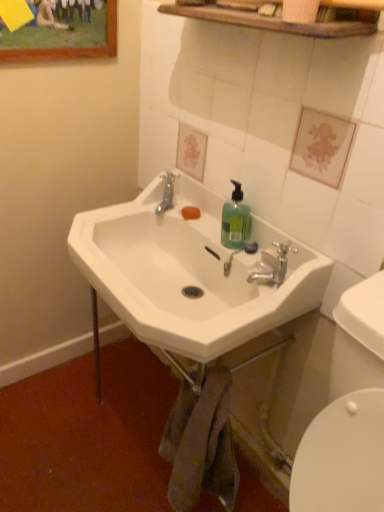
Question: Would you say silver metallic faucet at upper center, which appears as the second plumbing fixture when ordered from the bottom, is to the left or to the right of metallic silver faucet at lower center, which appears as the 2th plumbing fixture when viewed from the top, in the picture?

Choices:
 (A) right
 (B) left

Answer: (B)

Question: Looking at the image, does silver metallic faucet at upper center, the second plumbing fixture when ordered from right to left, seem bigger or smaller compared to metallic silver faucet at lower center, the 1th plumbing fixture viewed from the front?

Choices:
 (A) big
 (B) small

Answer: (A)

Question: Considering the real-world distances, which object is closest to the metallic silver faucet at lower center, which appears as the 2th plumbing fixture when viewed from the top?

Choices:
 (A) white ceramic sink at center
 (B) translucent green liquid at sink right
 (C) wooden framed painting at upper left
 (D) silver metallic faucet at upper center, which appears as the second plumbing fixture when ordered from the bottom

Answer: (B)

Question: Considering the real-world distances, which object is farthest from the translucent green liquid at sink right?

Choices:
 (A) white ceramic sink at center
 (B) metallic silver faucet at lower center, which is the 2th plumbing fixture from back to front
 (C) wooden framed painting at upper left
 (D) silver metallic faucet at upper center, marked as the 1th plumbing fixture in a back-to-front arrangement

Answer: (C)